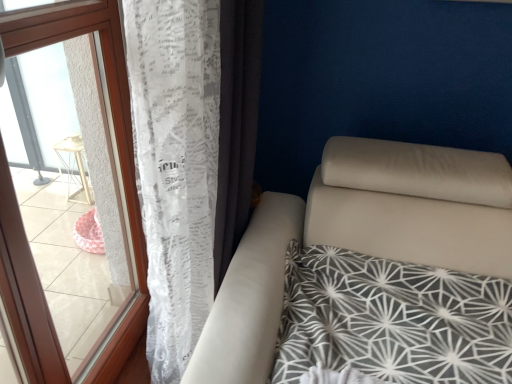
This screenshot has width=512, height=384. What do you see at coordinates (69, 196) in the screenshot?
I see `transparent plastic window at left` at bounding box center [69, 196].

This screenshot has width=512, height=384. Describe the element at coordinates (236, 125) in the screenshot. I see `white lace curtain at left, which is the second curtain in left-to-right order` at that location.

Locate an element on the screen. The height and width of the screenshot is (384, 512). transparent plastic window at left is located at coordinates (69, 196).

Is point (253, 76) behind point (156, 331)?

No, it is not.

From the image's perspective, is white lace curtain at left, which is the second curtain in left-to-right order, above or below white lace curtain at left, positioned as the first curtain in left-to-right order?

white lace curtain at left, which is the second curtain in left-to-right order, is situated higher than white lace curtain at left, positioned as the first curtain in left-to-right order, in the image.

Could you tell me if white lace curtain at left, the first curtain positioned from the right, is turned towards white lace curtain at left, which ranks as the second curtain in right-to-left order?

No, white lace curtain at left, the first curtain positioned from the right, is not facing towards white lace curtain at left, which ranks as the second curtain in right-to-left order.

Is white lace curtain at left, which is the second curtain in left-to-right order, far away from white lace curtain at left, which ranks as the second curtain in right-to-left order?

No, there isn't a large distance between white lace curtain at left, which is the second curtain in left-to-right order, and white lace curtain at left, which ranks as the second curtain in right-to-left order.

Which object is further away from the camera taking this photo, white lace curtain at left, which ranks as the second curtain in right-to-left order, or white lace curtain at left, which is the second curtain in left-to-right order?

white lace curtain at left, which is the second curtain in left-to-right order, is more distant.

Based on the photo, between white lace curtain at left, positioned as the first curtain in left-to-right order, and white lace curtain at left, the first curtain positioned from the right, which one has larger width?

white lace curtain at left, positioned as the first curtain in left-to-right order, is wider.

Considering the sizes of objects white lace curtain at left, which ranks as the second curtain in right-to-left order, and white lace curtain at left, which is the second curtain in left-to-right order, in the image provided, who is smaller, white lace curtain at left, which ranks as the second curtain in right-to-left order, or white lace curtain at left, which is the second curtain in left-to-right order,?

With smaller size is white lace curtain at left, which is the second curtain in left-to-right order.

Could white lace curtain at left, the first curtain positioned from the right, be considered to be inside white lace curtain at left, positioned as the first curtain in left-to-right order?

Yes, white lace curtain at left, the first curtain positioned from the right, is a part of white lace curtain at left, positioned as the first curtain in left-to-right order.

From the image's perspective, is white lace curtain at left, positioned as the first curtain in left-to-right order, located above transparent plastic window at left?

Yes.

Where is `window below the white lace curtain at left, which ranks as the second curtain in right-to-left order (from the image's perspective)`? The image size is (512, 384). window below the white lace curtain at left, which ranks as the second curtain in right-to-left order (from the image's perspective) is located at coordinates (69, 196).

In the scene shown: Is the depth of white lace curtain at left, positioned as the first curtain in left-to-right order, less than that of transparent plastic window at left?

No, it is behind transparent plastic window at left.

Does transparent plastic window at left turn towards white lace curtain at left, positioned as the first curtain in left-to-right order?

Yes, transparent plastic window at left is oriented towards white lace curtain at left, positioned as the first curtain in left-to-right order.

Is transparent plastic window at left outside of white lace curtain at left, positioned as the first curtain in left-to-right order?

Indeed, transparent plastic window at left is completely outside white lace curtain at left, positioned as the first curtain in left-to-right order.

Based on the photo, from a real-world perspective, is transparent plastic window at left on top of white lace curtain at left, positioned as the first curtain in left-to-right order?

No.

Does white lace curtain at left, the first curtain positioned from the right, have a larger size compared to transparent plastic window at left?

No, white lace curtain at left, the first curtain positioned from the right, is not bigger than transparent plastic window at left.

From the image's perspective, is white lace curtain at left, which is the second curtain in left-to-right order, on transparent plastic window at left?

Yes, from the image's perspective, white lace curtain at left, which is the second curtain in left-to-right order, is over transparent plastic window at left.

Considering the sizes of objects white lace curtain at left, the first curtain positioned from the right, and transparent plastic window at left in the image provided, who is shorter, white lace curtain at left, the first curtain positioned from the right, or transparent plastic window at left?

Standing shorter between the two is white lace curtain at left, the first curtain positioned from the right.

Is transparent plastic window at left not within white lace curtain at left, which is the second curtain in left-to-right order?

transparent plastic window at left is positioned outside white lace curtain at left, which is the second curtain in left-to-right order.

How different are the orientations of transparent plastic window at left and white lace curtain at left, which is the second curtain in left-to-right order, in degrees?

They differ by 1.06 degrees in their facing directions.

Who is smaller, transparent plastic window at left or white lace curtain at left, the first curtain positioned from the right?

Smaller between the two is white lace curtain at left, the first curtain positioned from the right.

Identify the location of curtain on the right side of white lace curtain at left, positioned as the first curtain in left-to-right order. The image size is (512, 384). (236, 125).

I want to click on curtain below the white lace curtain at left, which is the second curtain in left-to-right order (from the image's perspective), so click(175, 166).

Based on their spatial positions, is transparent plastic window at left or white lace curtain at left, positioned as the first curtain in left-to-right order, further from white lace curtain at left, the first curtain positioned from the right?

transparent plastic window at left.

From the image, which object appears to be nearer to white lace curtain at left, which ranks as the second curtain in right-to-left order, transparent plastic window at left or white lace curtain at left, the first curtain positioned from the right?

Based on the image, white lace curtain at left, the first curtain positioned from the right, appears to be nearer to white lace curtain at left, which ranks as the second curtain in right-to-left order.

Based on their spatial positions, is white lace curtain at left, the first curtain positioned from the right, or white lace curtain at left, which ranks as the second curtain in right-to-left order, further from transparent plastic window at left?

Based on the image, white lace curtain at left, the first curtain positioned from the right, appears to be further to transparent plastic window at left.

From the image, which object appears to be nearer to white lace curtain at left, which is the second curtain in left-to-right order, white lace curtain at left, which ranks as the second curtain in right-to-left order, or transparent plastic window at left?

white lace curtain at left, which ranks as the second curtain in right-to-left order.

From the image, which object appears to be nearer to white lace curtain at left, positioned as the first curtain in left-to-right order, white lace curtain at left, which is the second curtain in left-to-right order, or transparent plastic window at left?

Based on the image, white lace curtain at left, which is the second curtain in left-to-right order, appears to be nearer to white lace curtain at left, positioned as the first curtain in left-to-right order.

Estimate the real-world distances between objects in this image. Which object is closer to transparent plastic window at left, white lace curtain at left, positioned as the first curtain in left-to-right order, or white lace curtain at left, which is the second curtain in left-to-right order?

white lace curtain at left, positioned as the first curtain in left-to-right order, is positioned closer to the anchor transparent plastic window at left.

This screenshot has width=512, height=384. Identify the location of curtain between transparent plastic window at left and white lace curtain at left, which is the second curtain in left-to-right order, from left to right. (175, 166).